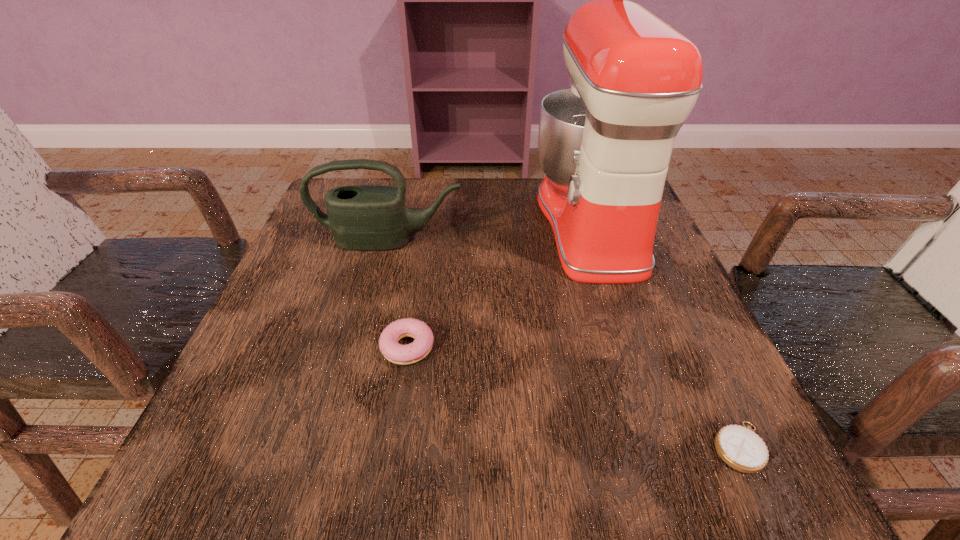
You are a GUI agent. You are given a task and a screenshot of the screen. Output one action in this format:
    pyautogui.click(x=<x>, y=<y>)
    Task: Click on the free region located on the front of the third farthest object
    The image size is (960, 540).
    Given the screenshot: What is the action you would take?
    pyautogui.click(x=391, y=449)

The height and width of the screenshot is (540, 960). Identify the location of free region located 0.400m on the back of the nearest object. (646, 247).

Locate an element on the screen. mixer located in the far edge section of the desktop is located at coordinates (605, 143).

You are a GUI agent. You are given a task and a screenshot of the screen. Output one action in this format:
    pyautogui.click(x=<x>, y=<y>)
    Task: Click on the watering can located at the far edge
    The height and width of the screenshot is (540, 960).
    Given the screenshot: What is the action you would take?
    pyautogui.click(x=362, y=217)

Find the location of a particular element. Image resolution: width=960 pixels, height=540 pixels. object that is positioned at the near edge is located at coordinates (740, 447).

Where is `object that is at the left edge`? The width and height of the screenshot is (960, 540). object that is at the left edge is located at coordinates (362, 217).

You are a GUI agent. You are given a task and a screenshot of the screen. Output one action in this format:
    pyautogui.click(x=<x>, y=<y>)
    Task: Click on the mixer at the right edge
    The width and height of the screenshot is (960, 540).
    Given the screenshot: What is the action you would take?
    pyautogui.click(x=605, y=143)

Find the location of a particular element. The width and height of the screenshot is (960, 540). compass located at the right edge is located at coordinates (740, 447).

Identify the location of object located in the far left corner section of the desktop. The height and width of the screenshot is (540, 960). (362, 217).

Image resolution: width=960 pixels, height=540 pixels. In order to click on object present at the far right corner in this screenshot , I will do `click(605, 143)`.